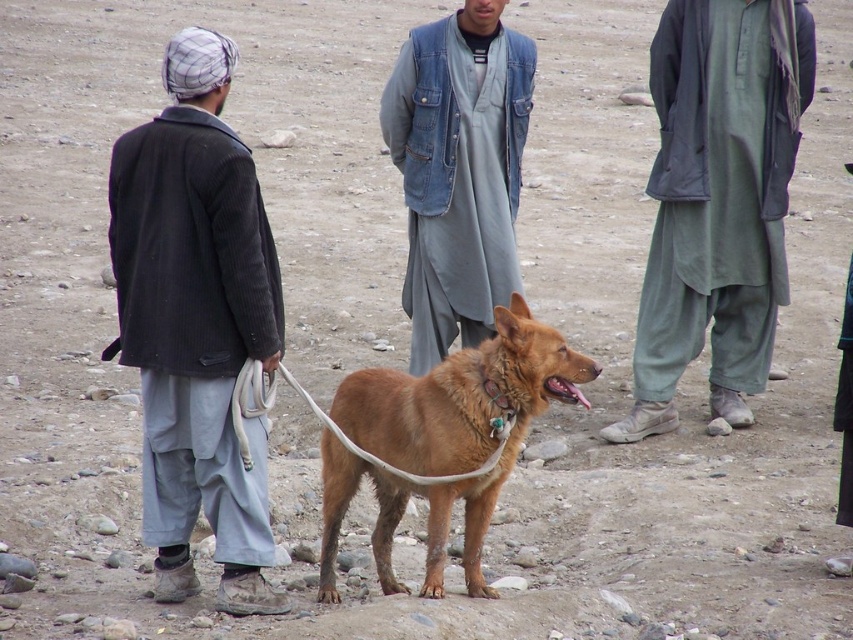
Is dark gray corduroy jacket at left to the right of white rope leash at center from the viewer's perspective?

In fact, dark gray corduroy jacket at left is to the left of white rope leash at center.

Does dark gray corduroy jacket at left appear under white rope leash at center?

Incorrect, dark gray corduroy jacket at left is not positioned below white rope leash at center.

Which is behind, point (222, 380) or point (245, 445)?

The point (222, 380) is more distant.

What are the coordinates of `dark gray corduroy jacket at left` in the screenshot? It's located at (196, 323).

Does dark gray corduroy jacket at left appear over brown furry dog at center?

Yes.

Between dark gray corduroy jacket at left and brown furry dog at center, which one is positioned higher?

dark gray corduroy jacket at left

Describe the element at coordinates (196, 323) in the screenshot. The width and height of the screenshot is (853, 640). I see `dark gray corduroy jacket at left` at that location.

At what (x,y) coordinates should I click in order to perform the action: click on dark gray corduroy jacket at left. Please return your answer as a coordinate pair (x, y). This screenshot has height=640, width=853. Looking at the image, I should click on (196, 323).

Does denim vest at center appear under white rope leash at center?

Actually, denim vest at center is above white rope leash at center.

Is denim vest at center thinner than white rope leash at center?

Yes, denim vest at center is thinner than white rope leash at center.

Is point (495, 164) positioned in front of point (497, 417)?

No.

At what (x,y) coordinates should I click in order to perform the action: click on denim vest at center. Please return your answer as a coordinate pair (x, y). Looking at the image, I should click on (457, 170).